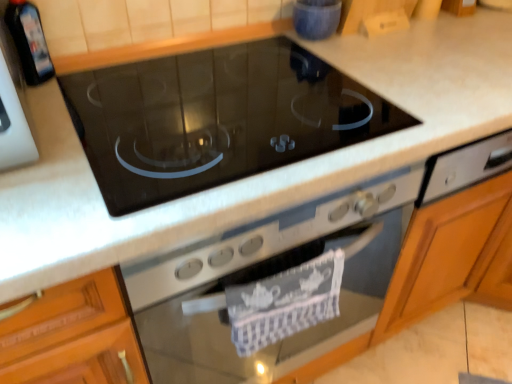
This screenshot has height=384, width=512. Find the location of `free space in front of black glass bottle at upper left, the first appliance viewed from the front`. free space in front of black glass bottle at upper left, the first appliance viewed from the front is located at coordinates (46, 103).